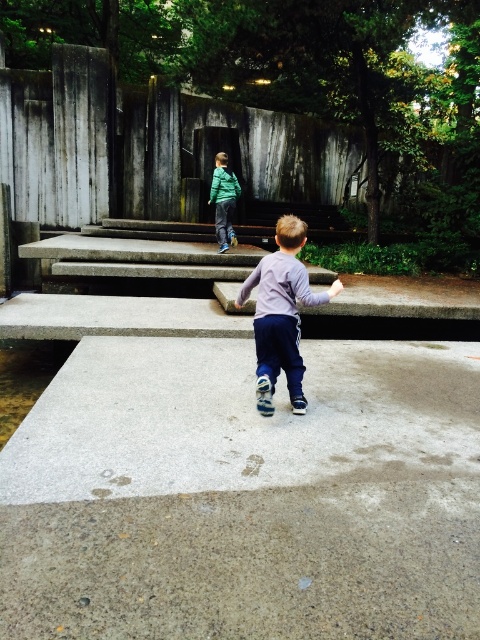
You are a parent trying to decide where to place a small toy car in the park scene. The toy car requires a flat, smooth surface. Based on the image, which area would be more suitable for placing the toy car, the gray polished concrete at center or the brown gravel at lower left?

Result: The gray polished concrete at center is larger in size than brown gravel at lower left, making it a more suitable area for placing the toy car since it provides a flatter and smoother surface compared to the gravel.

You are a parent trying to ensure your child can safely walk from the gray polished concrete at center to the green matte jacket at upper center. Considering their widths, which object is wider and might provide a more stable path?

The gray polished concrete at center is wider than the green matte jacket at upper center, so it would provide a more stable path for the child to walk on.

In the scene shown: You are a parent trying to ensure your child stays within the safe play area. The gray polished concrete at center and brown gravel at lower left are two distinct surfaces in the image. Can you determine if the distance between them is sufficient to prevent the child from easily moving from one to the other?

The gray polished concrete at center is 5.54 feet from brown gravel at lower left, which is a sufficient distance to prevent a child from easily moving between them in one jump or step.